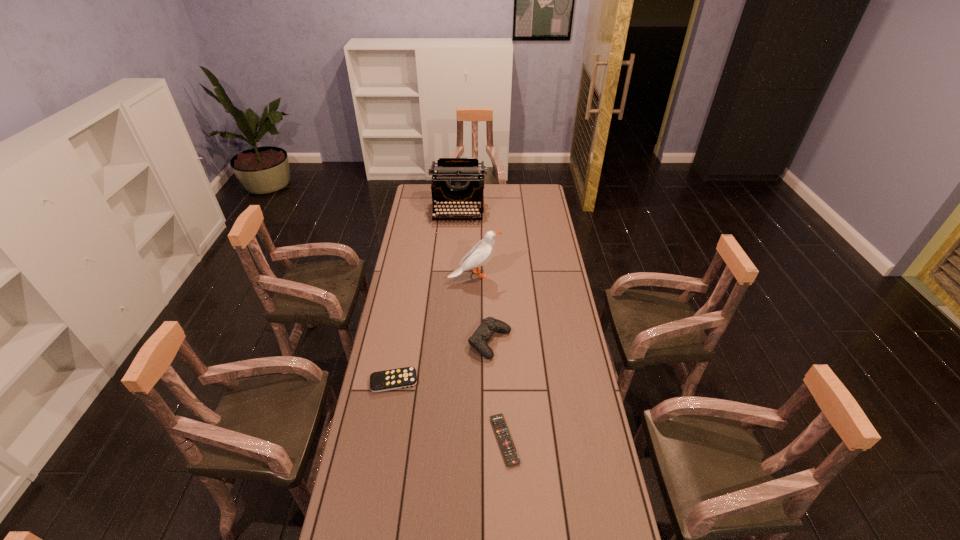
Where is `vacant space that's between the fourth nearest object and the typewriter`? vacant space that's between the fourth nearest object and the typewriter is located at coordinates (467, 243).

Identify the location of empty location between the nearest object and the fourth farthest object. (449, 411).

Identify the location of vacant point located between the nearest object and the fourth tallest object. Image resolution: width=960 pixels, height=540 pixels. (449, 411).

You are a GUI agent. You are given a task and a screenshot of the screen. Output one action in this format:
    pyautogui.click(x=<x>, y=<y>)
    Task: Click on the free area in between the gull and the typewriter
    This screenshot has height=540, width=960.
    Given the screenshot: What is the action you would take?
    pyautogui.click(x=467, y=243)

Identify the location of free space between the nearest object and the farther remote control. (449, 411).

Image resolution: width=960 pixels, height=540 pixels. Find the location of `vacant area that lies between the fourth nearest object and the fourth farthest object`. vacant area that lies between the fourth nearest object and the fourth farthest object is located at coordinates (434, 328).

The height and width of the screenshot is (540, 960). Identify the location of free space that is in between the taller remote control and the typewriter. [x=426, y=296].

You are a GUI agent. You are given a task and a screenshot of the screen. Output one action in this format:
    pyautogui.click(x=<x>, y=<y>)
    Task: Click on the empty space between the taller remote control and the third nearest object
    The width and height of the screenshot is (960, 540).
    Given the screenshot: What is the action you would take?
    pyautogui.click(x=442, y=362)

At what (x,y) coordinates should I click in order to perform the action: click on vacant area between the farther remote control and the gull. Please return your answer as a coordinate pair (x, y). The width and height of the screenshot is (960, 540). Looking at the image, I should click on (434, 328).

Where is `the fourth closest object to the third farthest object`? the fourth closest object to the third farthest object is located at coordinates (454, 180).